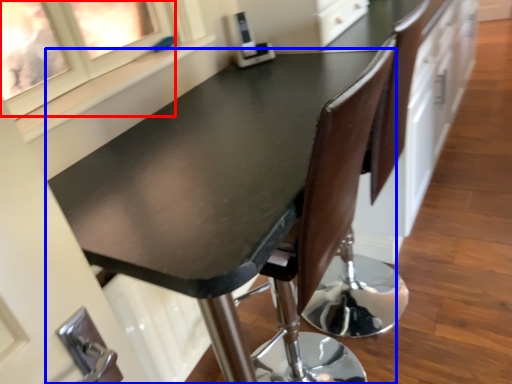
Question: Which point is further to the camera, window (highlighted by a red box) or table (highlighted by a blue box)?

Choices:
 (A) window
 (B) table

Answer: (A)